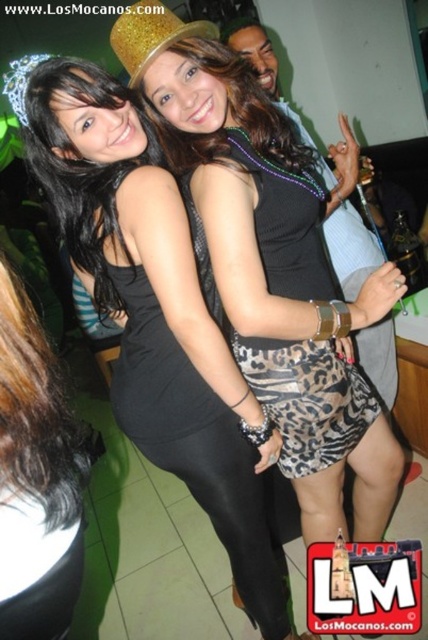
You are a photographer at a party and want to take a photo of the leopard print skirt at center and the silver metallic tiara at upper left. Which object is closer to the camera?

The leopard print skirt at center is positioned under the silver metallic tiara at upper left, meaning the tiara is closer to the camera than the skirt.

You are at a party and want to take a photo of the black matte dress at center and the silver metallic tiara at upper left. Which object should you focus on first if you want to capture both in the frame?

The black matte dress at center is positioned on the right side of the silver metallic tiara at upper left, so you should focus on the silver metallic tiara at upper left first to ensure both objects are in the frame.